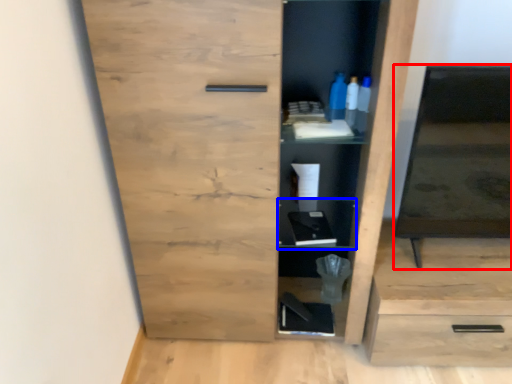
Question: Which point is further to the camera, medicine cabinet (highlighted by a red box) or cabinet (highlighted by a blue box)?

Choices:
 (A) medicine cabinet
 (B) cabinet

Answer: (B)